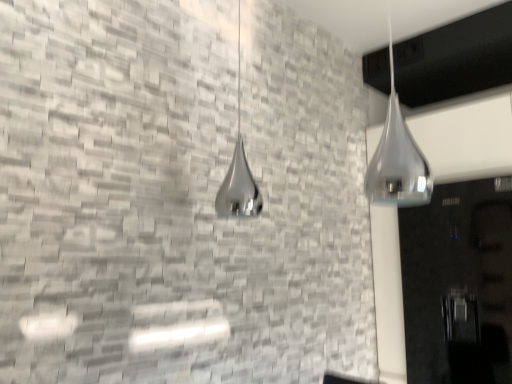
The height and width of the screenshot is (384, 512). Describe the element at coordinates (459, 284) in the screenshot. I see `glossy black door at right` at that location.

Measure the distance between polished chrome shower at upper right, which ranks as the first shower in right-to-left order, and camera.

polished chrome shower at upper right, which ranks as the first shower in right-to-left order, and camera are 1.68 meters apart.

Locate an element on the screen. The height and width of the screenshot is (384, 512). glossy black door at right is located at coordinates (459, 284).

From the image's perspective, is glossy black door at right located above polished chrome shower at upper right, which ranks as the first shower in right-to-left order?

Actually, glossy black door at right appears below polished chrome shower at upper right, which ranks as the first shower in right-to-left order, in the image.

Is glossy black door at right located outside polished chrome shower at upper right, the 2th shower positioned from the left?

That's correct, glossy black door at right is outside of polished chrome shower at upper right, the 2th shower positioned from the left.

Considering the relative positions of glossy black door at right and polished chrome shower at upper right, which is the first shower in front-to-back order, in the image provided, is glossy black door at right to the right of polished chrome shower at upper right, which is the first shower in front-to-back order, from the viewer's perspective?

Correct, you'll find glossy black door at right to the right of polished chrome shower at upper right, which is the first shower in front-to-back order.

Does point (424, 306) lie in front of point (381, 197)?

No.

From a real-world perspective, relative to polished chrome shower at center, acting as the 2th shower starting from the front, is glossy black door at right vertically above or below?

In terms of real-world spatial position, glossy black door at right is below polished chrome shower at center, acting as the 2th shower starting from the front.

Consider the image. Is glossy black door at right directly adjacent to polished chrome shower at center, acting as the 2th shower starting from the front?

No, glossy black door at right is not in contact with polished chrome shower at center, acting as the 2th shower starting from the front.

Is glossy black door at right aimed at polished chrome shower at center, marked as the 2th shower in a right-to-left arrangement?

Yes, glossy black door at right is aimed at polished chrome shower at center, marked as the 2th shower in a right-to-left arrangement.

From the image's perspective, is polished chrome shower at center, which is counted as the 1th shower, starting from the back, below polished chrome shower at upper right, the 2th shower positioned from the left?

No.

At what (x,y) coordinates should I click in order to perform the action: click on shower on the left of polished chrome shower at upper right, which is the first shower in front-to-back order. Please return your answer as a coordinate pair (x, y). Image resolution: width=512 pixels, height=384 pixels. Looking at the image, I should click on (239, 172).

How distant is polished chrome shower at center, acting as the 2th shower starting from the front, from polished chrome shower at upper right, which is the first shower in front-to-back order?

polished chrome shower at center, acting as the 2th shower starting from the front, is 77.17 centimeters away from polished chrome shower at upper right, which is the first shower in front-to-back order.

Which point is more distant from viewer, (x=240, y=119) or (x=424, y=188)?

The point (x=240, y=119) is farther from the camera.

Find the location of `door that is behind the polished chrome shower at upper right, which is the first shower in front-to-back order`. door that is behind the polished chrome shower at upper right, which is the first shower in front-to-back order is located at coordinates click(459, 284).

From the picture: Is polished chrome shower at upper right, which is the first shower in front-to-back order, positioned with its back to glossy black door at right?

polished chrome shower at upper right, which is the first shower in front-to-back order, does not have its back to glossy black door at right.

Choose the correct answer: Is polished chrome shower at upper right, the 2th shower positioned from the left, inside glossy black door at right or outside it?

polished chrome shower at upper right, the 2th shower positioned from the left, cannot be found inside glossy black door at right.

Locate an element on the screen. Image resolution: width=512 pixels, height=384 pixels. the 1st shower in front of the glossy black door at right, counting from the anchor's position is located at coordinates (239, 172).

Considering the positions of points (239, 165) and (478, 319), is point (239, 165) farther from camera compared to point (478, 319)?

No, it is not.

Looking at this image, which of these two, polished chrome shower at center, placed as the 1th shower when sorted from left to right, or glossy black door at right, is thinner?

polished chrome shower at center, placed as the 1th shower when sorted from left to right, is thinner.

From a real-world perspective, is polished chrome shower at center, acting as the 2th shower starting from the front, positioned above or below glossy black door at right?

polished chrome shower at center, acting as the 2th shower starting from the front, is situated higher than glossy black door at right in the real world.

Is polished chrome shower at upper right, which is the first shower in front-to-back order, at the left side of polished chrome shower at center, which is counted as the 1th shower, starting from the back?

No, polished chrome shower at upper right, which is the first shower in front-to-back order, is not to the left of polished chrome shower at center, which is counted as the 1th shower, starting from the back.

Who is shorter, polished chrome shower at upper right, placed as the second shower when sorted from back to front, or polished chrome shower at center, marked as the 2th shower in a right-to-left arrangement?

polished chrome shower at upper right, placed as the second shower when sorted from back to front, is shorter.

From the picture: Is polished chrome shower at upper right, the 2th shower positioned from the left, oriented away from polished chrome shower at center, placed as the 1th shower when sorted from left to right?

Yes.

What's the angular difference between polished chrome shower at upper right, which is the first shower in front-to-back order, and polished chrome shower at center, acting as the 2th shower starting from the front,'s facing directions?

The angular difference between polished chrome shower at upper right, which is the first shower in front-to-back order, and polished chrome shower at center, acting as the 2th shower starting from the front, is 0.000247 degrees.

The height and width of the screenshot is (384, 512). I want to click on door below the polished chrome shower at upper right, the 2th shower positioned from the left (from the image's perspective), so (x=459, y=284).

Image resolution: width=512 pixels, height=384 pixels. Identify the location of door that is on the right side of polished chrome shower at center, acting as the 2th shower starting from the front. (459, 284).

Looking at the image, which one is located closer to polished chrome shower at upper right, which ranks as the first shower in right-to-left order, glossy black door at right or polished chrome shower at center, placed as the 1th shower when sorted from left to right?

glossy black door at right is closer to polished chrome shower at upper right, which ranks as the first shower in right-to-left order.

Based on their spatial positions, is polished chrome shower at upper right, the 2th shower positioned from the left, or glossy black door at right closer to polished chrome shower at center, which is counted as the 1th shower, starting from the back?

Based on the image, polished chrome shower at upper right, the 2th shower positioned from the left, appears to be nearer to polished chrome shower at center, which is counted as the 1th shower, starting from the back.

Based on their spatial positions, is polished chrome shower at center, marked as the 2th shower in a right-to-left arrangement, or polished chrome shower at upper right, which is the first shower in front-to-back order, closer to glossy black door at right?

polished chrome shower at upper right, which is the first shower in front-to-back order.

Considering their positions, is polished chrome shower at upper right, which ranks as the first shower in right-to-left order, positioned closer to glossy black door at right than polished chrome shower at center, placed as the 1th shower when sorted from left to right?

polished chrome shower at upper right, which ranks as the first shower in right-to-left order, is closer to glossy black door at right.

In the scene shown: Which object lies further to the anchor point polished chrome shower at center, marked as the 2th shower in a right-to-left arrangement, glossy black door at right or polished chrome shower at upper right, the 2th shower positioned from the left?

glossy black door at right is positioned further to the anchor polished chrome shower at center, marked as the 2th shower in a right-to-left arrangement.

Based on their spatial positions, is polished chrome shower at center, placed as the 1th shower when sorted from left to right, or glossy black door at right closer to polished chrome shower at upper right, which ranks as the first shower in right-to-left order?

Among the two, glossy black door at right is located nearer to polished chrome shower at upper right, which ranks as the first shower in right-to-left order.

This screenshot has height=384, width=512. Find the location of `shower between polished chrome shower at center, which is counted as the 1th shower, starting from the back, and glossy black door at right, in the horizontal direction`. shower between polished chrome shower at center, which is counted as the 1th shower, starting from the back, and glossy black door at right, in the horizontal direction is located at coordinates (397, 157).